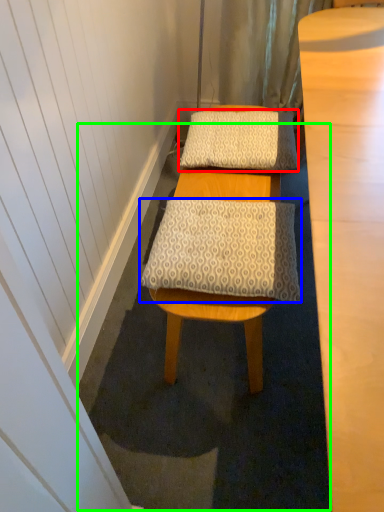
Question: Considering the real-world distances, which object is farthest from pillow (highlighted by a red box)? pillow (highlighted by a blue box) or bath mat (highlighted by a green box)?

Choices:
 (A) pillow
 (B) bath mat

Answer: (B)